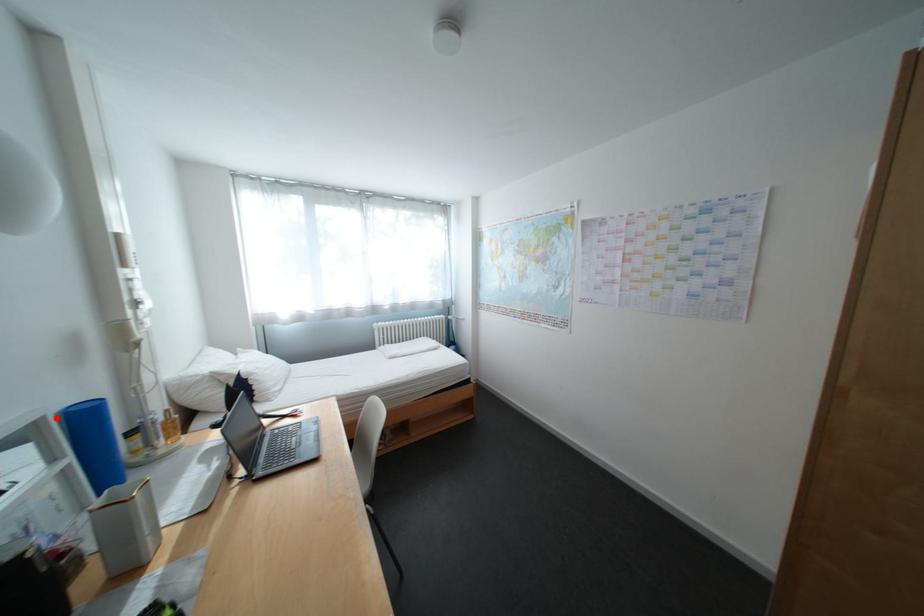
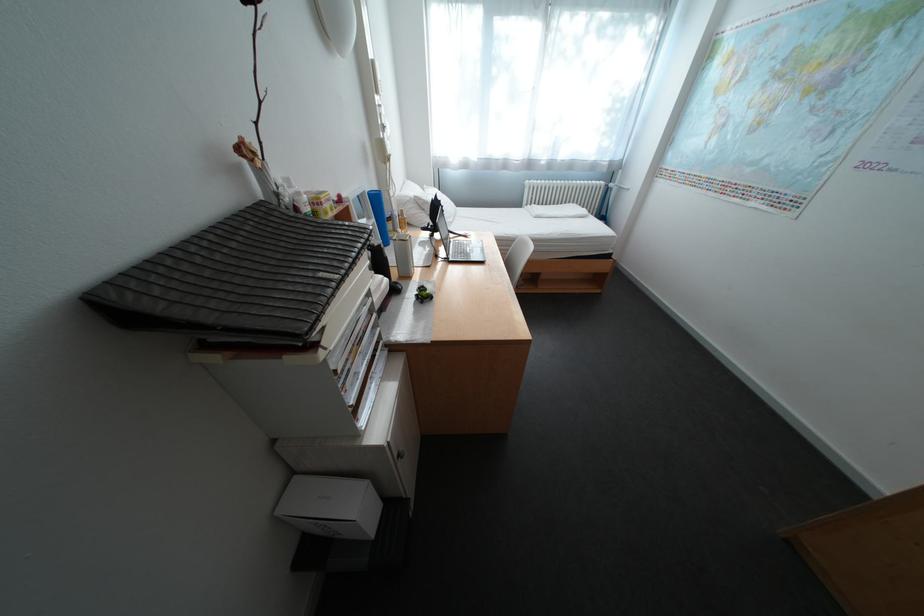
Question: I am providing you with two images of the same scene from different viewpoints. In image1, a red point is highlighted. Considering the same 3D point in image2, which of the following is correct?

Choices:
 (A) It is closer
 (B) It is farther

Answer: (A)